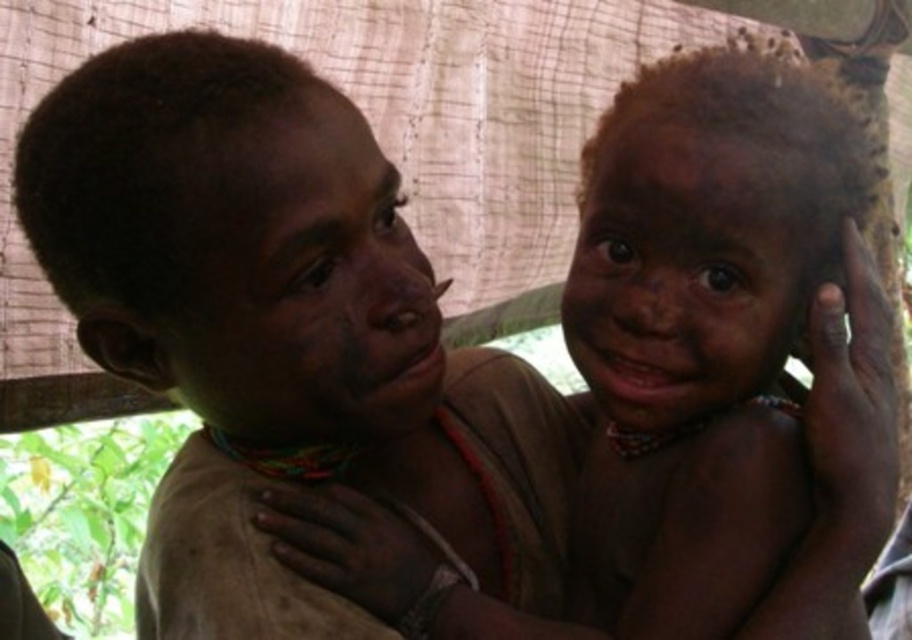
Between dark skin textured face at center and dark skin face at center, which one is positioned higher?

dark skin face at center is higher up.

Can you confirm if dark skin textured face at center is wider than dark skin face at center?

Correct, the width of dark skin textured face at center exceeds that of dark skin face at center.

What are the coordinates of `dark skin textured face at center` in the screenshot? It's located at [x=309, y=291].